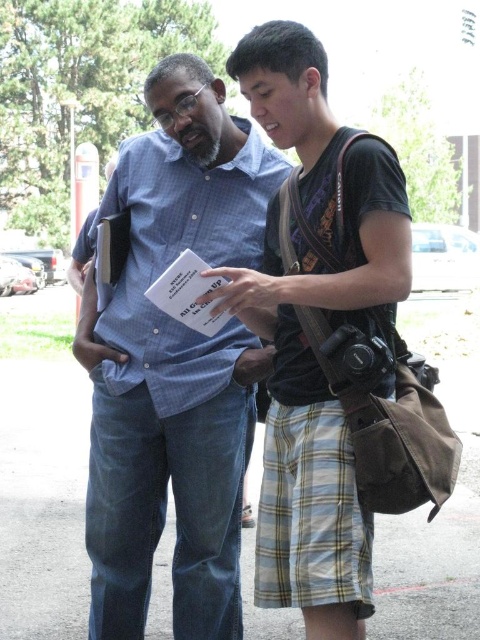
You are a photographer trying to capture a candid shot of both the blue checkered shirt at center and the plaid cotton shorts at center in the same frame. Based on their positions, do you think you can fit both into your camera viewfinder without zooming out?

The blue checkered shirt at center might be wider than plaid cotton shorts at center, so it is possible to fit both into the camera viewfinder without zooming out as long as the total width of both items does not exceed the viewfinder capacity.

You are a photographer trying to capture a candid shot of the two people discussing the document. The camera you are using has a minimum focusing distance of 18 inches. Based on the distance between the blue checkered shirt at center and the plaid cotton shorts at center, can you take a clear photo of both subjects without blurring?

The blue checkered shirt at center is 17.78 inches away from the plaid cotton shorts at center. Since the minimum focusing distance is 18 inches, the camera cannot focus clearly on both subjects simultaneously because the distance between them is slightly less than the required minimum. You might need to step back slightly or use a different lens to ensure both are in focus.